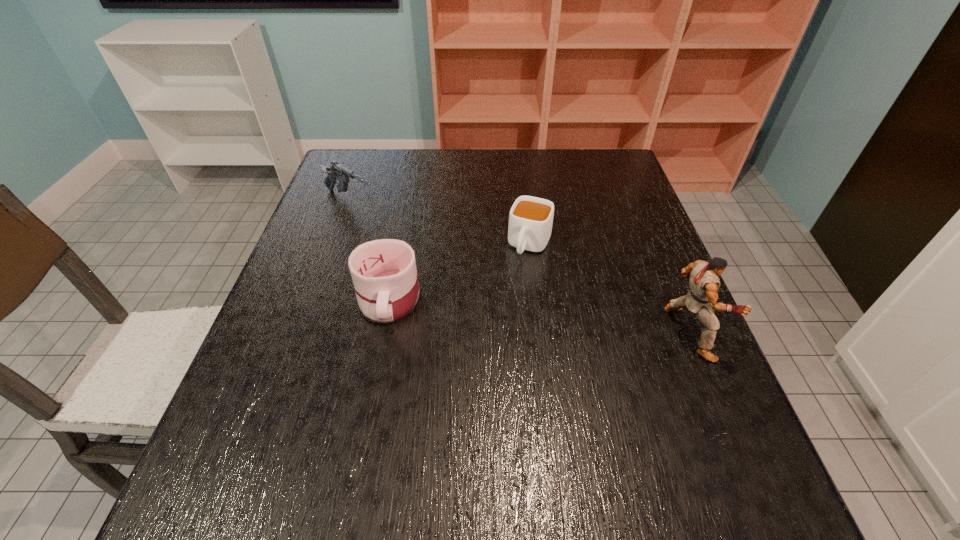
At what (x,y) coordinates should I click in order to perform the action: click on vacant space located 0.110m at the barrel of the gun. Please return your answer as a coordinate pair (x, y). The width and height of the screenshot is (960, 540). Looking at the image, I should click on [398, 230].

At what (x,y) coordinates should I click in order to perform the action: click on vacant space situated 0.330m on the side with the handle of the third nearest object. Please return your answer as a coordinate pair (x, y). This screenshot has height=540, width=960. Looking at the image, I should click on tap(474, 374).

Locate an element on the screen. vacant space located on the side with the handle of the third nearest object is located at coordinates (470, 383).

The image size is (960, 540). Find the location of `vacant area situated on the side with the handle of the third nearest object`. vacant area situated on the side with the handle of the third nearest object is located at coordinates (516, 281).

Where is `object that is at the far edge`? The width and height of the screenshot is (960, 540). object that is at the far edge is located at coordinates (335, 171).

This screenshot has width=960, height=540. In order to click on object positioned at the left edge in this screenshot , I will do `click(335, 171)`.

Locate an element on the screen. The height and width of the screenshot is (540, 960). object at the right edge is located at coordinates click(704, 282).

Locate an element on the screen. object present at the far left corner is located at coordinates (335, 171).

The height and width of the screenshot is (540, 960). In order to click on vacant space at the far edge of the desktop in this screenshot , I will do `click(458, 151)`.

Find the location of a particular element. The width and height of the screenshot is (960, 540). vacant space at the near edge is located at coordinates (638, 443).